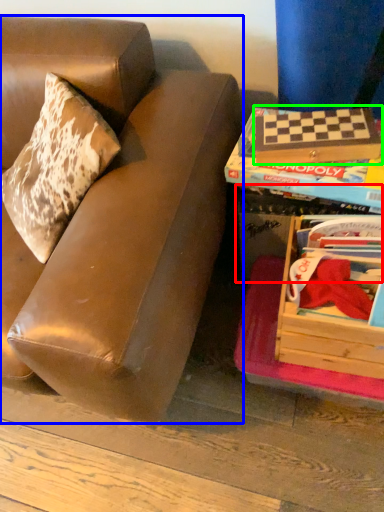
Question: Based on their relative distances, which object is farther from storage box (highlighted by a red box)? Choose from studio couch (highlighted by a blue box) and paperback book (highlighted by a green box).

Choices:
 (A) studio couch
 (B) paperback book

Answer: (A)